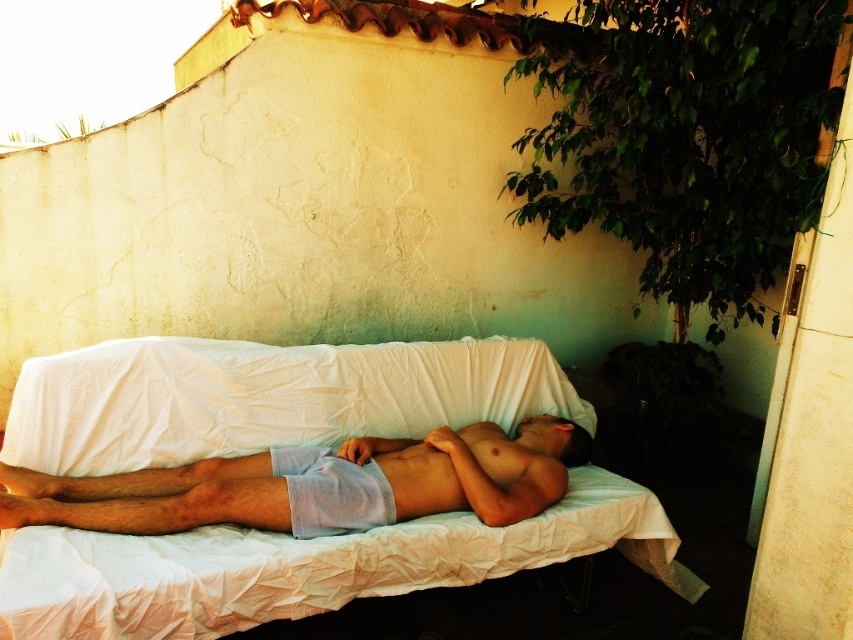
Which is more to the left, white fabric bed at center or light blue cotton shorts at center?

From the viewer's perspective, white fabric bed at center appears more on the left side.

Between point (416, 372) and point (22, 472), which one is positioned in front?

Point (22, 472)

Who is more distant from viewer, (463, 573) or (24, 468)?

The point (463, 573) is behind.

At what (x,y) coordinates should I click in order to perform the action: click on white fabric bed at center. Please return your answer as a coordinate pair (x, y). Looking at the image, I should click on pos(302,566).